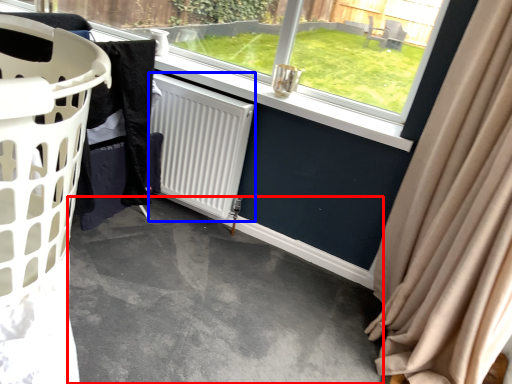
Question: Which point is closer to the camera, concrete (highlighted by a red box) or radiator (highlighted by a blue box)?

Choices:
 (A) concrete
 (B) radiator

Answer: (A)